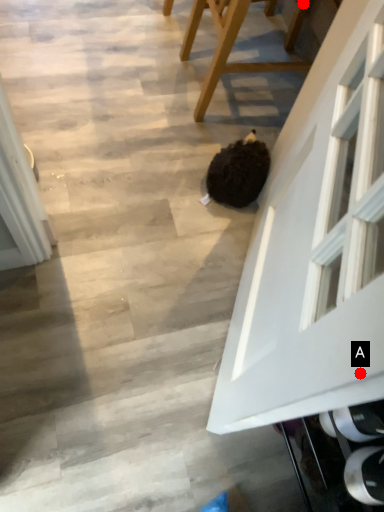
Question: Two points are circled on the image, labeled by A and B beside each circle. Which of the following is the farthest from the observer?

Choices:
 (A) A is further
 (B) B is further

Answer: (B)